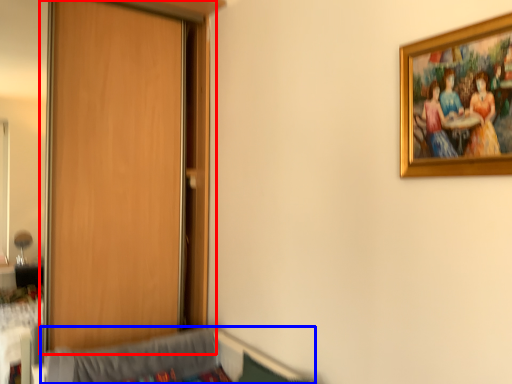
Question: Which object is further to the camera taking this photo, door (highlighted by a red box) or hospital bed (highlighted by a blue box)?

Choices:
 (A) door
 (B) hospital bed

Answer: (A)